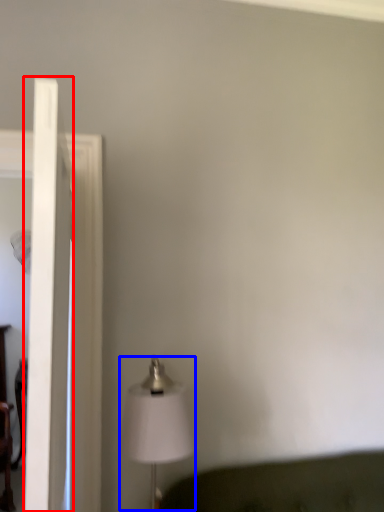
Question: Which object appears farthest to the camera in this image, glass door (highlighted by a red box) or lamp (highlighted by a blue box)?

Choices:
 (A) glass door
 (B) lamp

Answer: (B)